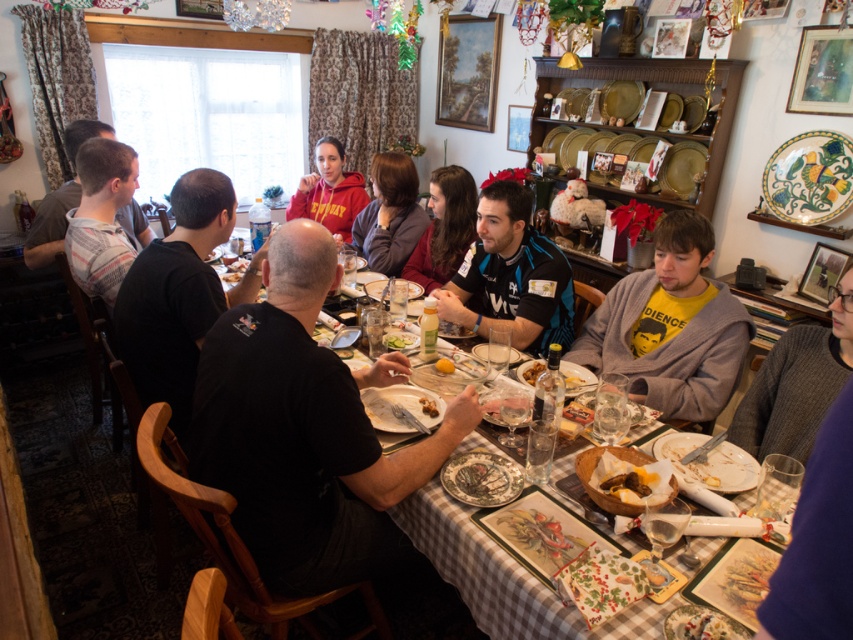
Question: Estimate the real-world distances between objects in this image. Which object is farther from the white checkered tablecloth at center?

Choices:
 (A) black matte shirt at center
 (B) purple fabric at lower right

Answer: (B)

Question: Which object is farther from the camera taking this photo?

Choices:
 (A) matte black hair at center
 (B) golden-brown bread basket at lower center

Answer: (A)

Question: In this image, where is black matte shirt at center located relative to green leafy vegetable at center?

Choices:
 (A) right
 (B) left

Answer: (B)

Question: Which object is closer to the camera taking this photo?

Choices:
 (A) yellowish matte bread at center
 (B) purple fabric at lower right

Answer: (B)

Question: Does golden-brown bread basket at lower center appear on the left side of golden brown bread at center?

Choices:
 (A) no
 (B) yes

Answer: (A)

Question: Can you confirm if white creamy pasta at lower right is positioned below yellow matte lemon at center?

Choices:
 (A) no
 (B) yes

Answer: (B)